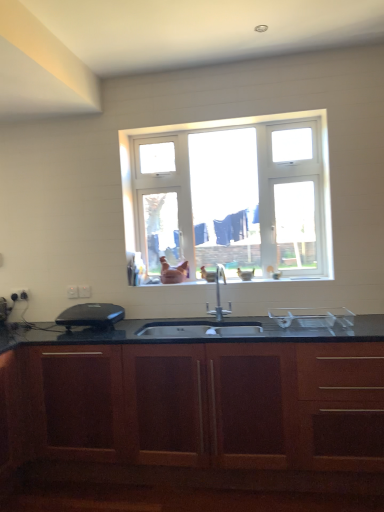
Question: Could you tell me if white glossy sink at center is facing white plastic electric outlet at lower left, which appears as the 1th electric outlet when viewed from the right?

Choices:
 (A) yes
 (B) no

Answer: (B)

Question: Is white glossy sink at center in contact with white plastic electric outlet at lower left, the third electric outlet positioned from the left?

Choices:
 (A) yes
 (B) no

Answer: (B)

Question: From the image's perspective, is white glossy sink at center on white plastic electric outlet at lower left, which is the first electric outlet from front to back?

Choices:
 (A) yes
 (B) no

Answer: (A)

Question: Can you confirm if white glossy sink at center is wider than white plastic electric outlet at lower left, the third electric outlet positioned from the left?

Choices:
 (A) no
 (B) yes

Answer: (B)

Question: Is white glossy sink at center not within white plastic electric outlet at lower left, which appears as the 1th electric outlet when viewed from the right?

Choices:
 (A) yes
 (B) no

Answer: (A)

Question: Is white glossy sink at center smaller than white plastic electric outlet at lower left, which is the first electric outlet from front to back?

Choices:
 (A) yes
 (B) no

Answer: (B)

Question: Is wooden cabinet at center surrounded by white plastic window at center?

Choices:
 (A) yes
 (B) no

Answer: (B)

Question: Does white plastic window at center have a smaller size compared to wooden cabinet at center?

Choices:
 (A) no
 (B) yes

Answer: (B)

Question: Considering the relative sizes of white plastic window at center and wooden cabinet at center in the image provided, is white plastic window at center thinner than wooden cabinet at center?

Choices:
 (A) yes
 (B) no

Answer: (A)

Question: Considering the relative positions of white plastic window at center and wooden cabinet at center in the image provided, is white plastic window at center to the left of wooden cabinet at center from the viewer's perspective?

Choices:
 (A) yes
 (B) no

Answer: (B)

Question: From the image's perspective, does white plastic window at center appear higher than wooden cabinet at center?

Choices:
 (A) yes
 (B) no

Answer: (A)

Question: Is white plastic window at center oriented towards wooden cabinet at center?

Choices:
 (A) yes
 (B) no

Answer: (B)

Question: Is wooden cabinet at center turned away from white plastic electric outlet at lower left, the first electric outlet in the back-to-front sequence?

Choices:
 (A) no
 (B) yes

Answer: (A)